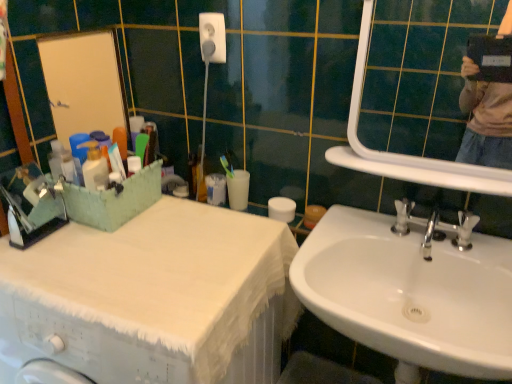
Question: Is point (347, 288) positioned closer to the camera than point (234, 175)?

Choices:
 (A) farther
 (B) closer

Answer: (B)

Question: Considering the positions of white glossy sink at lower right and white matte toilet paper at center in the image, is white glossy sink at lower right taller or shorter than white matte toilet paper at center?

Choices:
 (A) short
 (B) tall

Answer: (B)

Question: Which object is positioned closest to the white matte toilet paper at center?

Choices:
 (A) white glossy mirror at upper right
 (B) white glossy sink at lower right
 (C) white fabric covered at left

Answer: (C)

Question: Based on their relative distances, which object is nearer to the white fabric covered at left?

Choices:
 (A) white matte toilet paper at center
 (B) white glossy mirror at upper right
 (C) white glossy sink at lower right

Answer: (C)